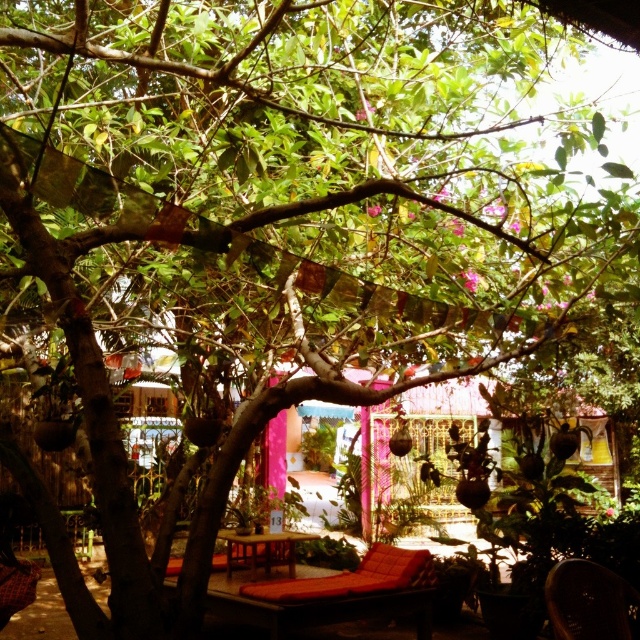
What is the position of the metallic gold chair at lower right relative to the wooden table at center?

The metallic gold chair at lower right is positioned to the right of the wooden table at center.

You are standing at the point with coordinates (588, 602) in the garden. What object is located exactly at this point?

The metallic gold chair at lower right is located exactly at point (588, 602).

You are standing in the garden scene described. You need to place a small potted plant exactly at the coordinates mentioned for the metallic gold chair at lower right. What are the coordinates where you should place the potted plant?

The coordinates for the metallic gold chair at lower right are (x=588, y=602). Therefore, you should place the potted plant at those coordinates.